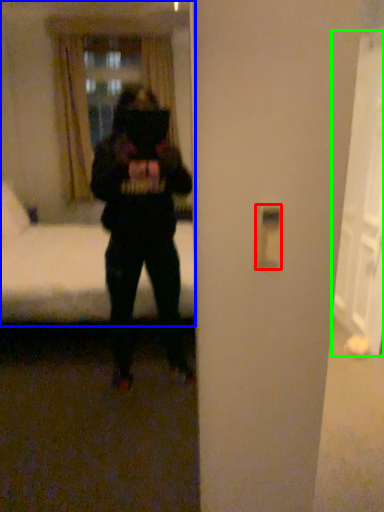
Question: Which is nearer to the light switch (highlighted by a red box)? mirror (highlighted by a blue box) or glass door (highlighted by a green box).

Choices:
 (A) mirror
 (B) glass door

Answer: (B)